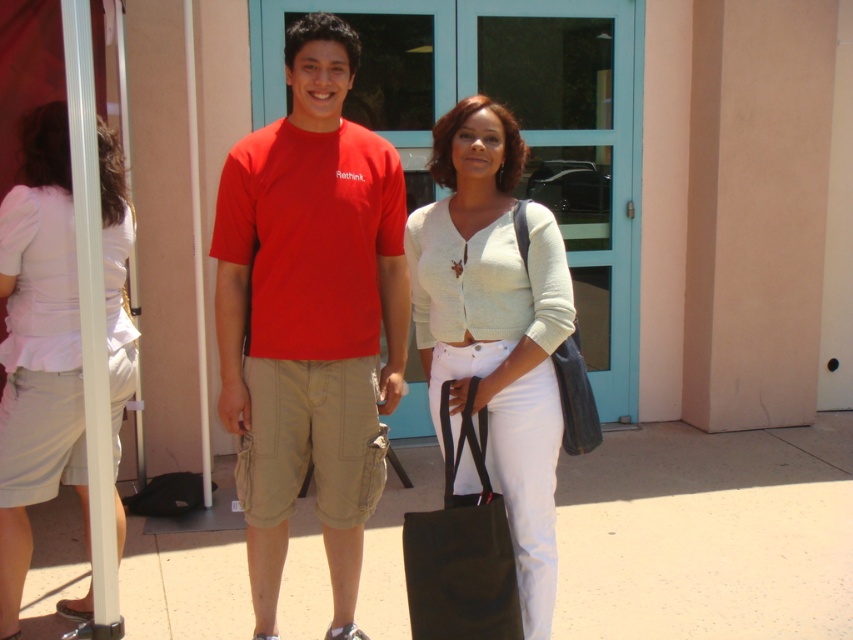
Between smooth concrete pavement at center and matte red t-shirt at center, which one has less height?

With less height is smooth concrete pavement at center.

What do you see at coordinates (706, 534) in the screenshot?
I see `smooth concrete pavement at center` at bounding box center [706, 534].

Does point (697, 579) come in front of point (322, 124)?

No, (697, 579) is behind (322, 124).

Identify the location of smooth concrete pavement at center. (706, 534).

Is smooth concrete pavement at center smaller than light pink fabric blouse at left?

Actually, smooth concrete pavement at center might be larger than light pink fabric blouse at left.

Can you confirm if smooth concrete pavement at center is positioned to the left of light pink fabric blouse at left?

No, smooth concrete pavement at center is not to the left of light pink fabric blouse at left.

Between point (834, 531) and point (38, 243), which one is positioned behind?

The point (834, 531) is more distant.

Locate an element on the screen. smooth concrete pavement at center is located at coordinates (706, 534).

Which is in front, point (24, 160) or point (521, 253)?

Point (521, 253) is in front.

Describe the element at coordinates (38, 348) in the screenshot. The image size is (853, 640). I see `light pink fabric blouse at left` at that location.

What do you see at coordinates (38, 348) in the screenshot?
I see `light pink fabric blouse at left` at bounding box center [38, 348].

This screenshot has width=853, height=640. I want to click on light pink fabric blouse at left, so click(38, 348).